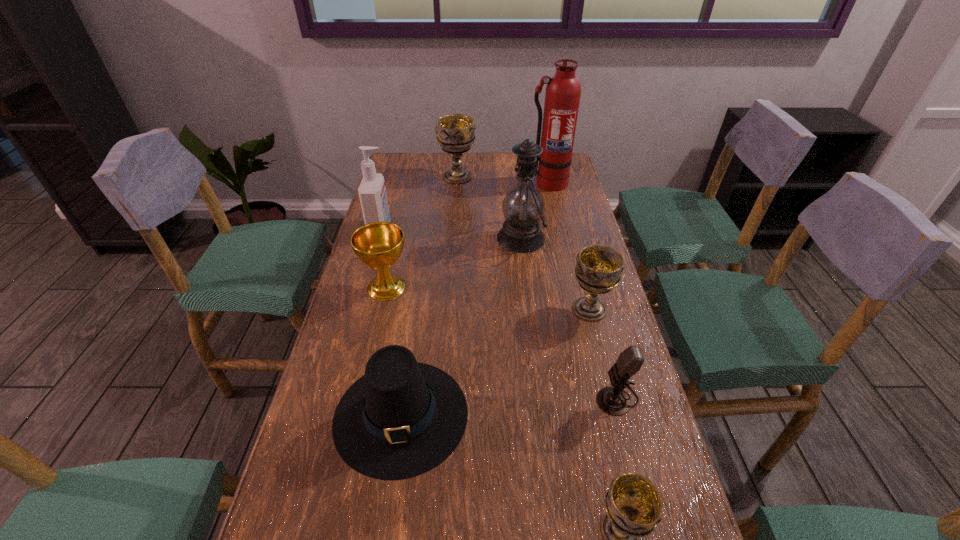
Locate an element on the screen. This screenshot has width=960, height=540. vacant position located 0.240m on the front of the oil lamp is located at coordinates (530, 318).

I want to click on free space located 0.190m on the front label of the cleansing agent, so click(448, 229).

Locate an element on the screen. free space located 0.210m on the front of the leftmost white chalice is located at coordinates (454, 218).

What are the coordinates of `vacant space located 0.100m on the back of the leftmost chalice` in the screenshot? It's located at (x=396, y=251).

The image size is (960, 540). Find the location of `vacant region located on the left of the second biggest white chalice`. vacant region located on the left of the second biggest white chalice is located at coordinates (501, 309).

Image resolution: width=960 pixels, height=540 pixels. What are the coordinates of `blank space located 0.310m on the front-facing side of the microphone` in the screenshot? It's located at (458, 397).

Find the location of a particular element. The width and height of the screenshot is (960, 540). free location located on the front-facing side of the microphone is located at coordinates (516, 397).

Find the location of `blank space located 0.180m on the front-facing side of the microphone`. blank space located 0.180m on the front-facing side of the microphone is located at coordinates (516, 397).

This screenshot has height=540, width=960. I want to click on vacant space situated on the front-facing side of the gray hat, so click(x=385, y=525).

I want to click on fire extinguisher present at the far edge, so click(x=563, y=91).